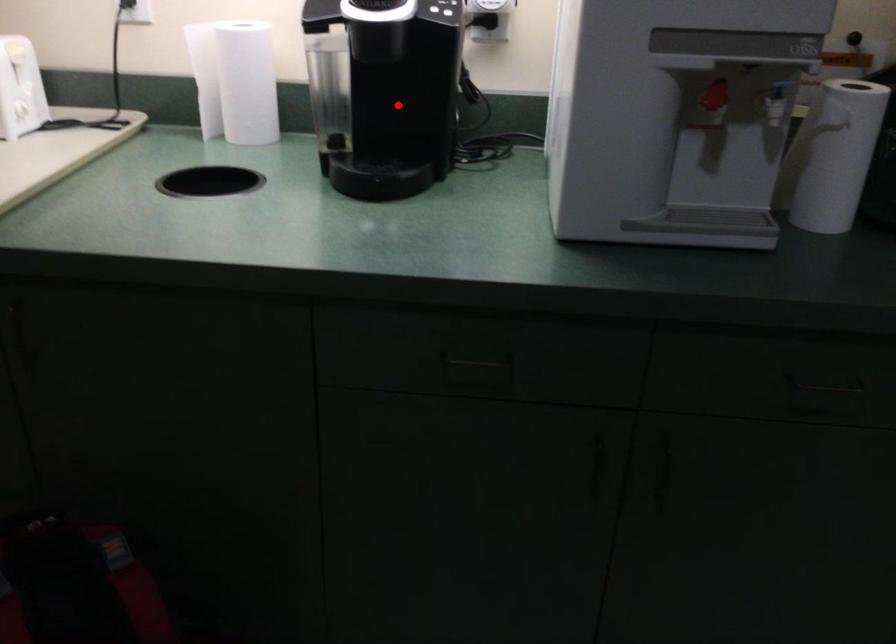
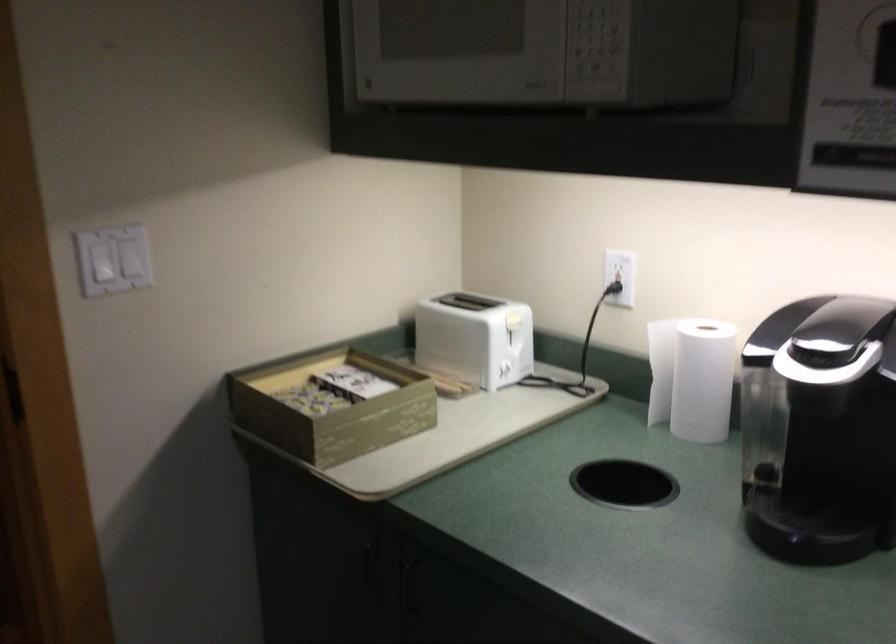
In the second image, find the point that corresponds to the highlighted location in the first image.

(839, 458)